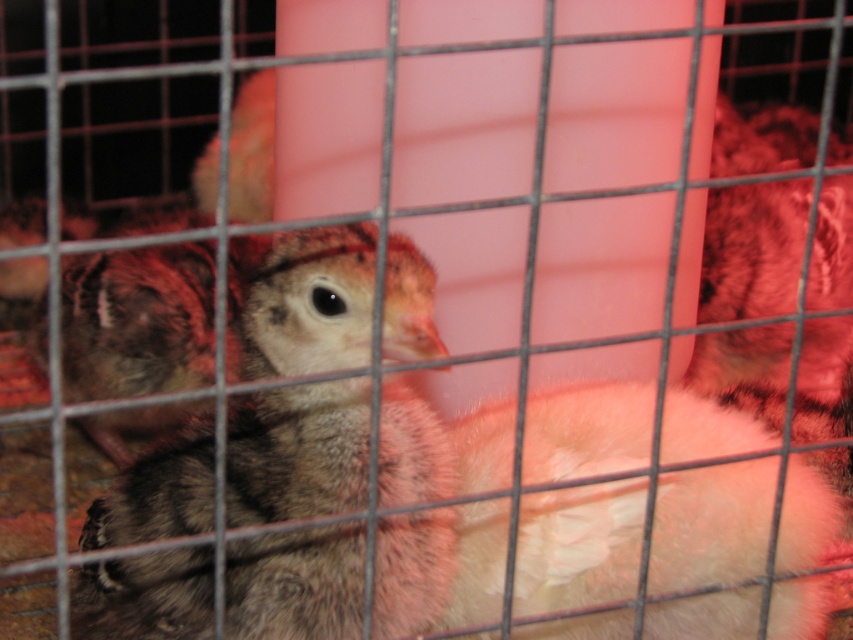
You are a farmer checking the health of the turkeys in the cage. You notice two birds at the center of the cage. Which one is smaller in size between the speckled feathered chick at center and the fluffy brown chicken at center?

The speckled feathered chick at center is smaller in size than the fluffy brown chicken at center because it occupies less space.

You are a farmer checking the health of the baby turkeys in the cage. You notice a point at coordinate (299, 452). What is the object located at that coordinate?

The point at coordinate (299, 452) corresponds to the speckled feathered chick at center.